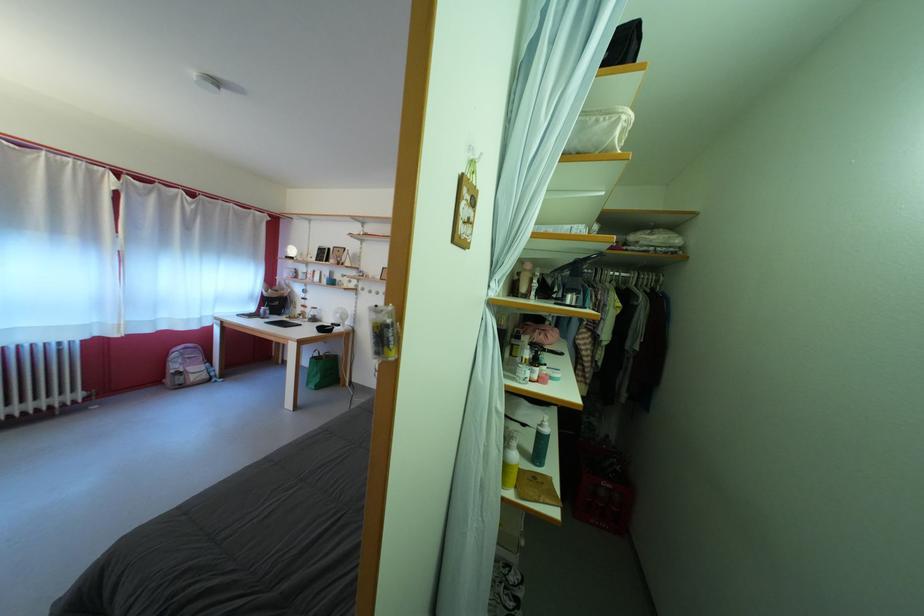
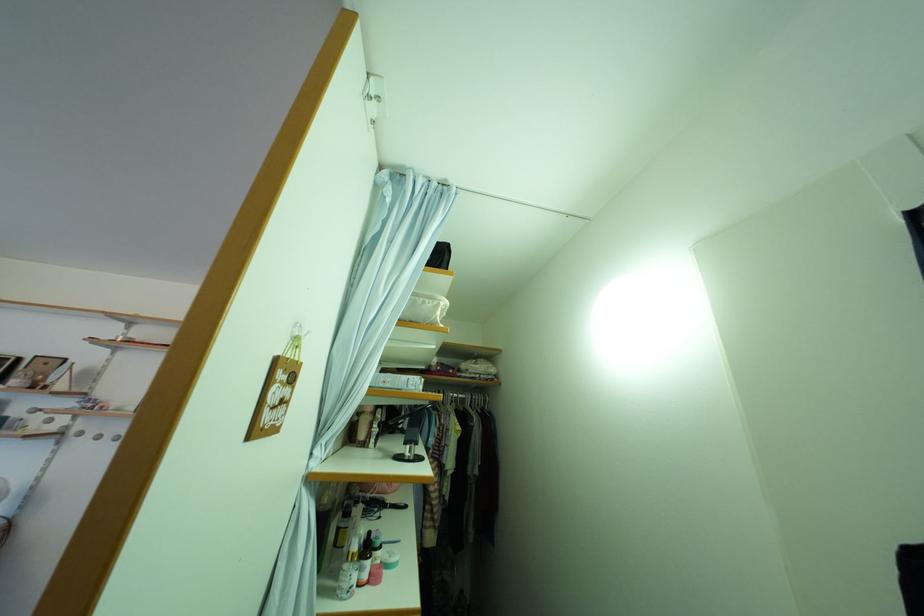
Where in the second image is the point corresponding to (602,195) from the first image?

(434, 351)